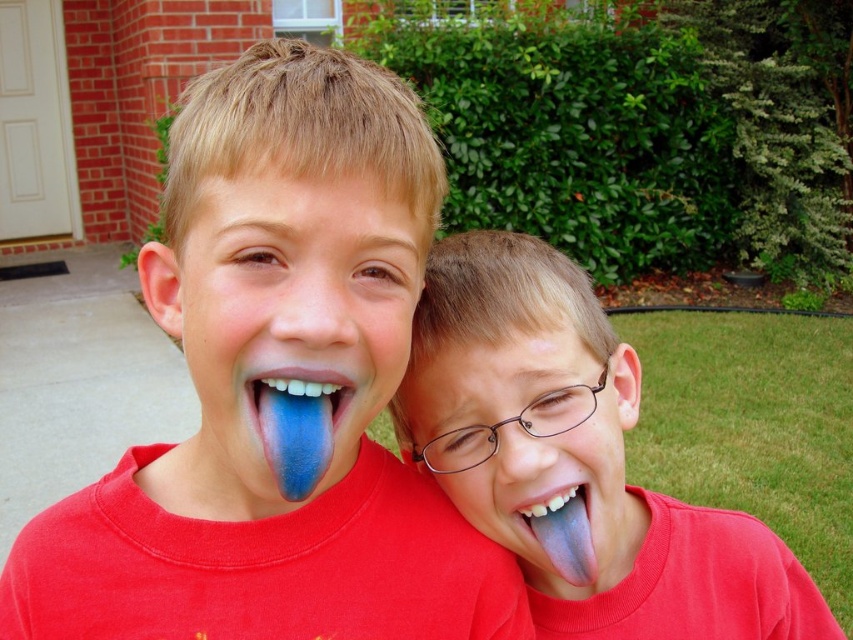
Question: Is blue glossy tongue at center further to the viewer compared to blue rubber tongue at right?

Choices:
 (A) no
 (B) yes

Answer: (A)

Question: Among these objects, which one is farthest from the camera?

Choices:
 (A) blue matte tongue at center
 (B) blue rubber tongue at right
 (C) blue glossy tongue at center
 (D) blue painted tongue at center

Answer: (B)

Question: Where is blue painted tongue at center located in relation to blue matte tongue at center in the image?

Choices:
 (A) below
 (B) above

Answer: (B)

Question: Is blue rubber tongue at right above blue matte tongue at center?

Choices:
 (A) no
 (B) yes

Answer: (A)

Question: Which point is closer to the camera taking this photo?

Choices:
 (A) (207, 582)
 (B) (488, 355)
 (C) (357, 419)
 (D) (270, 428)

Answer: (D)

Question: Which point is closer to the camera?

Choices:
 (A) (308, 381)
 (B) (241, 193)

Answer: (B)